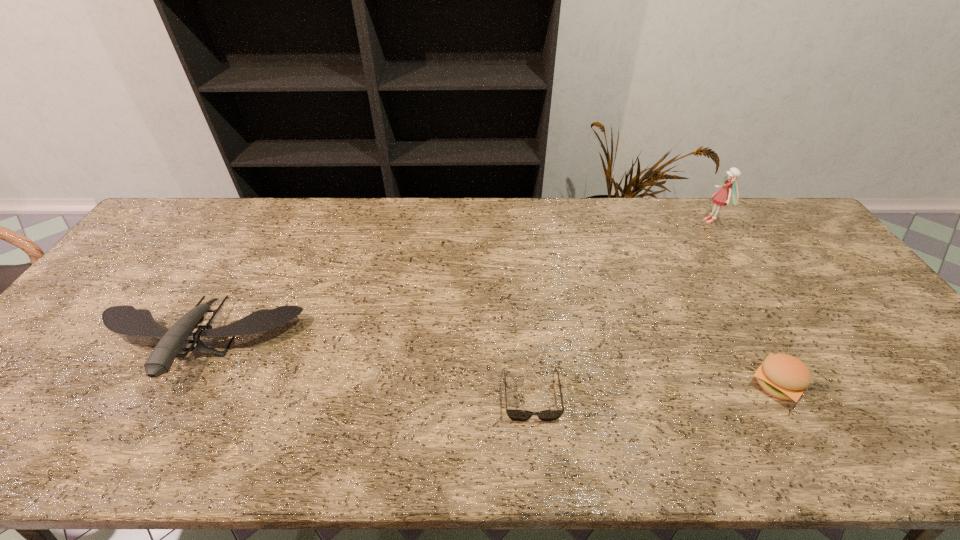
What are the coordinates of `doll` in the screenshot? It's located at (721, 197).

The width and height of the screenshot is (960, 540). Identify the location of the farthest object. (721, 197).

Find the location of a particular element. the leftmost object is located at coordinates [126, 320].

Locate an element on the screen. the third shortest object is located at coordinates (126, 320).

Identify the location of hamburger. The width and height of the screenshot is (960, 540). (783, 376).

At what (x,y) coordinates should I click in order to perform the action: click on the shortest object. Please return your answer as a coordinate pair (x, y). The height and width of the screenshot is (540, 960). Looking at the image, I should click on (517, 415).

This screenshot has width=960, height=540. In order to click on the second object from left to right in this screenshot , I will do `click(517, 415)`.

What are the coordinates of `vacant space situated on the front-facing side of the doll` in the screenshot? It's located at (621, 221).

Identify the location of vacant region located 0.090m on the front-facing side of the doll. This screenshot has height=540, width=960. (677, 221).

I want to click on vacant space situated on the front-facing side of the doll, so click(594, 221).